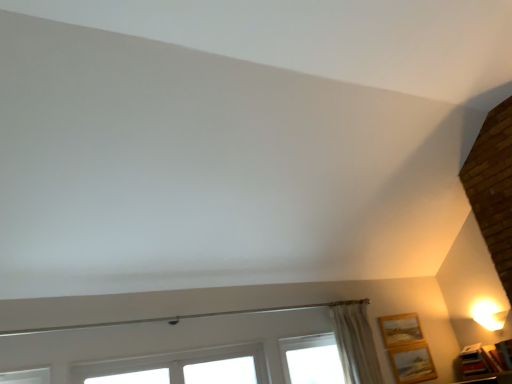
Question: Could you tell me if wooden picture frame at lower right, the second picture frame when ordered from left to right, is facing wooden picture frame at lower right, positioned as the third picture frame in right-to-left order?

Choices:
 (A) yes
 (B) no

Answer: (B)

Question: Can you confirm if wooden picture frame at lower right, the second picture frame when ordered from left to right, is smaller than wooden picture frame at lower right, positioned as the third picture frame in right-to-left order?

Choices:
 (A) no
 (B) yes

Answer: (B)

Question: From the image's perspective, is wooden picture frame at lower right, arranged as the 2th picture frame when viewed from the right, located above wooden picture frame at lower right, positioned as the third picture frame in right-to-left order?

Choices:
 (A) no
 (B) yes

Answer: (A)

Question: Is wooden picture frame at lower right, arranged as the 2th picture frame when viewed from the right, wider than wooden picture frame at lower right, the first picture frame from the left?

Choices:
 (A) yes
 (B) no

Answer: (B)

Question: Is wooden picture frame at lower right, the second picture frame when ordered from left to right, surrounding wooden picture frame at lower right, positioned as the third picture frame in right-to-left order?

Choices:
 (A) yes
 (B) no

Answer: (B)

Question: Considering the relative sizes of wooden picture frame at lower right, the second picture frame when ordered from left to right, and wooden picture frame at lower right, positioned as the third picture frame in right-to-left order, in the image provided, is wooden picture frame at lower right, the second picture frame when ordered from left to right, shorter than wooden picture frame at lower right, positioned as the third picture frame in right-to-left order,?

Choices:
 (A) no
 (B) yes

Answer: (A)

Question: From a real-world perspective, is wooden picture frame at lower right, positioned as the third picture frame in left-to-right order, located higher than white glossy table lamp at upper right?

Choices:
 (A) no
 (B) yes

Answer: (A)

Question: Is wooden picture frame at lower right, which is counted as the first picture frame, starting from the right, bigger than white glossy table lamp at upper right?

Choices:
 (A) no
 (B) yes

Answer: (A)

Question: Can you confirm if wooden picture frame at lower right, positioned as the third picture frame in left-to-right order, is shorter than white glossy table lamp at upper right?

Choices:
 (A) no
 (B) yes

Answer: (A)

Question: Is wooden picture frame at lower right, which is counted as the first picture frame, starting from the right, closer to the viewer compared to white glossy table lamp at upper right?

Choices:
 (A) no
 (B) yes

Answer: (B)

Question: Is the position of wooden picture frame at lower right, which is counted as the first picture frame, starting from the right, more distant than that of white glossy table lamp at upper right?

Choices:
 (A) yes
 (B) no

Answer: (B)

Question: Is wooden picture frame at lower right, which is counted as the first picture frame, starting from the right, looking in the opposite direction of white glossy table lamp at upper right?

Choices:
 (A) yes
 (B) no

Answer: (B)

Question: Can you confirm if wooden picture frame at lower right, the first picture frame from the left, is smaller than white plastic window at lower center?

Choices:
 (A) yes
 (B) no

Answer: (A)